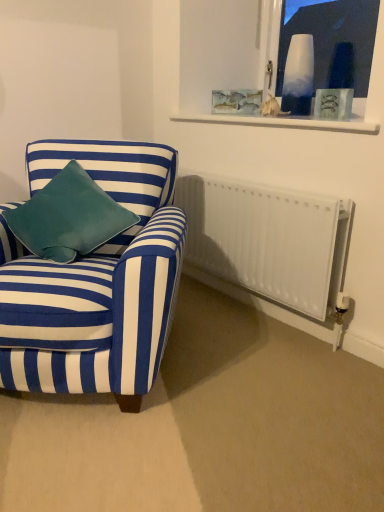
At what (x,y) coordinates should I click in order to perform the action: click on white glass vase at upper right. Please return your answer as a coordinate pair (x, y). The height and width of the screenshot is (512, 384). Looking at the image, I should click on (331, 37).

This screenshot has width=384, height=512. Describe the element at coordinates (68, 217) in the screenshot. I see `velvet teal pillow at left` at that location.

You are a GUI agent. You are given a task and a screenshot of the screen. Output one action in this format:
    pyautogui.click(x=<x>, y=<y>)
    Task: Click on the blue striped fabric armchair at left
    The height and width of the screenshot is (512, 384).
    Given the screenshot: What is the action you would take?
    pyautogui.click(x=95, y=280)

Can you tell me how much white glass vase at upper right and white matte radiator at lower right differ in facing direction?

They differ by 0.806 degrees in their facing directions.

Is white matte radiator at lower right at the back of white glass vase at upper right?

No, white glass vase at upper right's orientation is not away from white matte radiator at lower right.

Can you confirm if white glass vase at upper right is thinner than white matte radiator at lower right?

Yes.

Considering the positions of point (323, 54) and point (301, 304), is point (323, 54) closer or farther from the camera than point (301, 304)?

Point (323, 54) is positioned farther from the camera compared to point (301, 304).

Considering the relative positions of white matte radiator at lower right and clear glass frame at upper center in the image provided, is white matte radiator at lower right to the left or to the right of clear glass frame at upper center?

Based on their positions, white matte radiator at lower right is located to the left of clear glass frame at upper center.

Is white matte radiator at lower right placed right next to clear glass frame at upper center?

They are not placed beside each other.

From the image's perspective, which one is positioned lower, white matte radiator at lower right or clear glass frame at upper center?

white matte radiator at lower right, from the image's perspective.

How many degrees apart are the facing directions of white matte radiator at lower right and clear glass frame at upper center?

They differ by 28.1 degrees in their facing directions.

Is clear glass frame at upper center aimed at white matte radiator at lower right?

No, clear glass frame at upper center is not aimed at white matte radiator at lower right.

Can you confirm if clear glass frame at upper center is wider than white matte radiator at lower right?

No.

Which of these two, clear glass frame at upper center or white matte radiator at lower right, is bigger?

white matte radiator at lower right is bigger.

From the image's perspective, which object appears higher, clear glass frame at upper center or white matte radiator at lower right?

From the image's view, clear glass frame at upper center is above.

Considering the points (58, 256) and (322, 102), which point is in front, point (58, 256) or point (322, 102)?

The point (58, 256) is closer to the camera.

Is velvet teal pillow at left to the left of clear glass frame at upper center from the viewer's perspective?

Indeed, velvet teal pillow at left is positioned on the left side of clear glass frame at upper center.

From a real-world perspective, which object stands above the other?

clear glass frame at upper center, from a real-world perspective.

Is velvet teal pillow at left shorter than clear glass frame at upper center?

No, velvet teal pillow at left is not shorter than clear glass frame at upper center.

Does point (105, 156) come behind point (184, 179)?

No.

Considering the sizes of blue striped fabric armchair at left and white matte radiator at lower right in the image, is blue striped fabric armchair at left taller or shorter than white matte radiator at lower right?

blue striped fabric armchair at left is taller than white matte radiator at lower right.

From the image's perspective, is blue striped fabric armchair at left over white matte radiator at lower right?

No.

You are a GUI agent. You are given a task and a screenshot of the screen. Output one action in this format:
    pyautogui.click(x=<x>, y=<y>)
    Task: Click on the chair lying in front of the white matte radiator at lower right
    This screenshot has width=384, height=512.
    Given the screenshot: What is the action you would take?
    pyautogui.click(x=95, y=280)

Does velvet teal pillow at left contain blue striped fabric armchair at left?

No, blue striped fabric armchair at left is located outside of velvet teal pillow at left.

From a real-world perspective, is velvet teal pillow at left positioned under blue striped fabric armchair at left based on gravity?

Actually, velvet teal pillow at left is physically above blue striped fabric armchair at left in the real world.

Can you confirm if velvet teal pillow at left is positioned to the left of blue striped fabric armchair at left?

Yes, velvet teal pillow at left is to the left of blue striped fabric armchair at left.

Do you think blue striped fabric armchair at left is within clear glass frame at upper center, or outside of it?

blue striped fabric armchair at left is not enclosed by clear glass frame at upper center.

Which of these two, blue striped fabric armchair at left or clear glass frame at upper center, is wider?

Wider between the two is blue striped fabric armchair at left.

Is blue striped fabric armchair at left facing towards clear glass frame at upper center?

No, blue striped fabric armchair at left is not oriented towards clear glass frame at upper center.

You are a GUI agent. You are given a task and a screenshot of the screen. Output one action in this format:
    pyautogui.click(x=<x>, y=<y>)
    Task: Click on the radiator that appears on the left of white glass vase at upper right
    This screenshot has width=384, height=512.
    Given the screenshot: What is the action you would take?
    pyautogui.click(x=268, y=240)

Identify the location of radiator located underneath the clear glass frame at upper center (from a real-world perspective). This screenshot has height=512, width=384. (268, 240).

When comparing their distances from white glass vase at upper right, does clear glass frame at upper center or white matte radiator at lower right seem further?

Based on the image, white matte radiator at lower right appears to be further to white glass vase at upper right.

Estimate the real-world distances between objects in this image. Which object is further from clear glass frame at upper center, white matte radiator at lower right or blue striped fabric armchair at left?

Among the two, blue striped fabric armchair at left is located further to clear glass frame at upper center.

Based on their spatial positions, is clear glass frame at upper center or blue striped fabric armchair at left closer to white matte radiator at lower right?

Based on the image, blue striped fabric armchair at left appears to be nearer to white matte radiator at lower right.

Looking at the image, which one is located closer to white glass vase at upper right, clear glass frame at upper center or blue striped fabric armchair at left?

Among the two, clear glass frame at upper center is located nearer to white glass vase at upper right.

From the image, which object appears to be farther from white matte radiator at lower right, white glass vase at upper right or velvet teal pillow at left?

Based on the image, white glass vase at upper right appears to be further to white matte radiator at lower right.

Which object lies further to the anchor point white matte radiator at lower right, clear glass frame at upper center or velvet teal pillow at left?

velvet teal pillow at left lies further to white matte radiator at lower right than the other object.

From the image, which object appears to be nearer to velvet teal pillow at left, white matte radiator at lower right or clear glass frame at upper center?

Based on the image, white matte radiator at lower right appears to be nearer to velvet teal pillow at left.

From the image, which object appears to be farther from white matte radiator at lower right, blue striped fabric armchair at left or clear glass frame at upper center?

The object further to white matte radiator at lower right is clear glass frame at upper center.

Identify the location of picture frame between blue striped fabric armchair at left and white glass vase at upper right. (333, 103).

Where is `radiator between blue striped fabric armchair at left and clear glass frame at upper center from left to right`? The width and height of the screenshot is (384, 512). radiator between blue striped fabric armchair at left and clear glass frame at upper center from left to right is located at coordinates (268, 240).

The height and width of the screenshot is (512, 384). I want to click on chair situated between velvet teal pillow at left and clear glass frame at upper center from left to right, so click(95, 280).

The image size is (384, 512). Identify the location of picture frame between white glass vase at upper right and white matte radiator at lower right in the up-down direction. (333, 103).